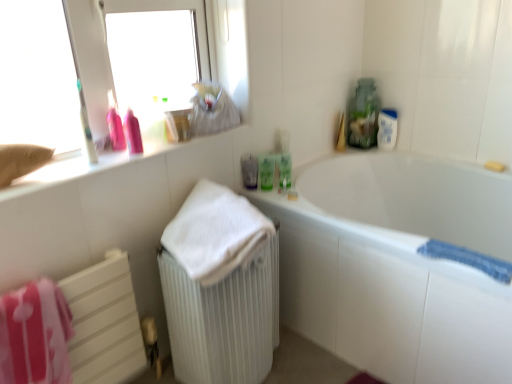
Question: Is point (181, 309) closer or farther from the camera than point (287, 165)?

Choices:
 (A) closer
 (B) farther

Answer: (A)

Question: From the image's perspective, is white ribbed radiator at lower left above or below green matte bottle at upper right, which is the 3th mouthwash from left to right?

Choices:
 (A) below
 (B) above

Answer: (A)

Question: Which is farther from the blue textured bath towel at lower right, marked as the 3th bath towel in a left-to-right arrangement?

Choices:
 (A) green matte bottle at upper right, which is the first mouthwash in right-to-left order
 (B) pink matte bottle at upper left, the 1th cleaning product from the left
 (C) white plastic bottle at upper right
 (D) yellow matte bar of soap at upper right
 (E) pink fabric towel at lower left, which is the 1th bath towel in left-to-right order

Answer: (B)

Question: Which object is the farthest from the translucent plastic cup at center, arranged as the 3th mouthwash when viewed from the right?

Choices:
 (A) blue textured bath towel at lower right, acting as the first bath towel starting from the right
 (B) green matte bottle at upper right, which is the 3th mouthwash from left to right
 (C) matte white counter at upper left
 (D) yellow matte bar of soap at upper right
 (E) pink plastic spray bottle at upper left, placed as the first cleaning product when sorted from right to left

Answer: (D)